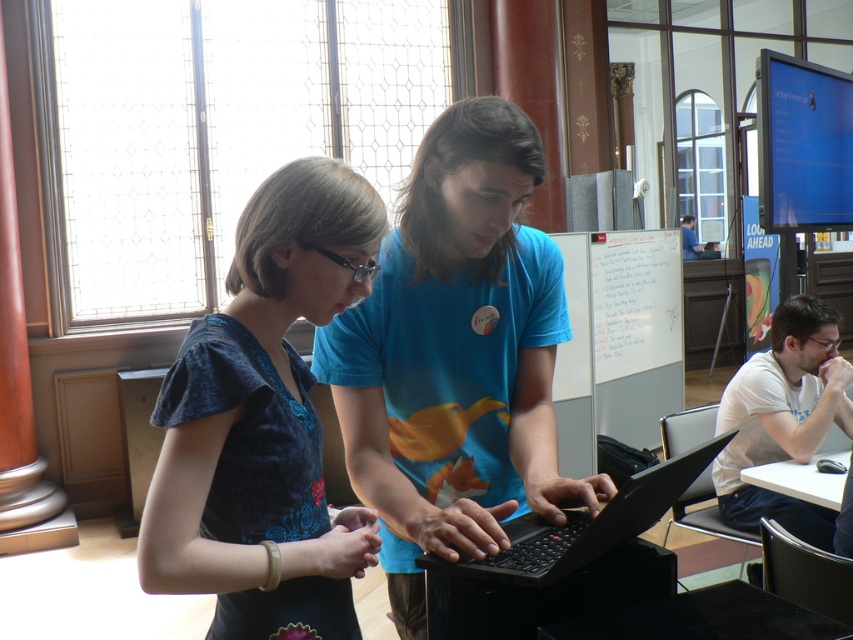
You are an interior designer assessing the layout of this room. You notice the blue matte shirt at center and the whiteboard at center. Which object is shorter?

The blue matte shirt at center is shorter than the whiteboard at center.